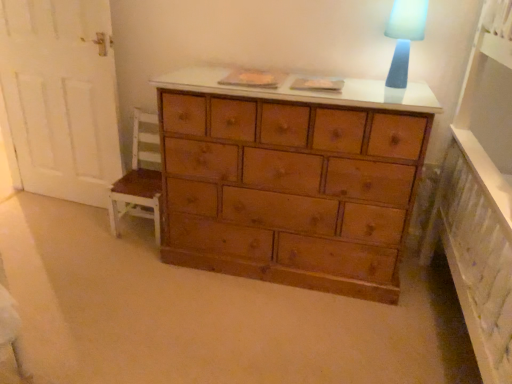
Image resolution: width=512 pixels, height=384 pixels. Find the location of `blank space to the left of white painted wood chair at left`. blank space to the left of white painted wood chair at left is located at coordinates (86, 229).